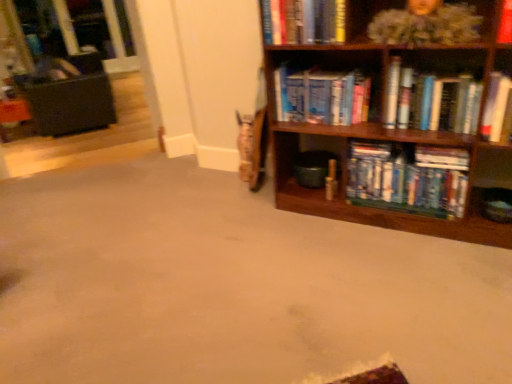
Question: Considering the positions of black leather swivel chair at left and wooden bookcase at right in the image, is black leather swivel chair at left wider or thinner than wooden bookcase at right?

Choices:
 (A) wide
 (B) thin

Answer: (A)

Question: Relative to wooden bookcase at right, is black leather swivel chair at left in front or behind?

Choices:
 (A) front
 (B) behind

Answer: (B)

Question: Based on their relative distances, which object is nearer to the hardcover book at upper right, the third book from the top?

Choices:
 (A) black leather swivel chair at left
 (B) wooden bookcase at right
 (C) hardcover books at center, which is the 1th book in bottom-to-top order
 (D) hardcover book at right, the second book ordered from the bottom
 (E) hardcover books at center, the 4th book when ordered from bottom to top

Answer: (B)

Question: Which of these objects is positioned farthest from the black leather swivel chair at left?

Choices:
 (A) hardcover book at upper right, the third book from the top
 (B) hardcover books at center, which ranks as the 2th book in top-to-bottom order
 (C) hardcover book at upper center, which ranks as the 1th book in top-to-bottom order
 (D) hardcover books at center, placed as the 5th book when sorted from top to bottom
 (E) wooden bookcase at right

Answer: (A)